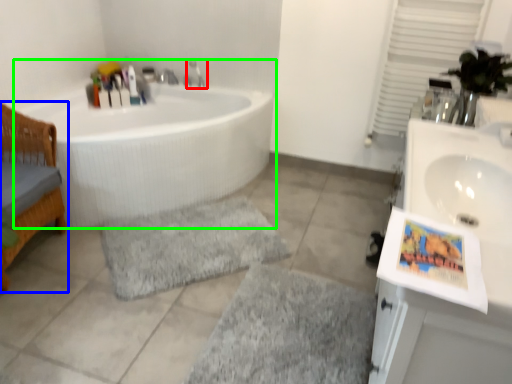
Question: Based on their relative distances, which object is nearer to tap (highlighted by a red box)? Choose from furniture (highlighted by a blue box) and bathtub (highlighted by a green box).

Choices:
 (A) furniture
 (B) bathtub

Answer: (B)